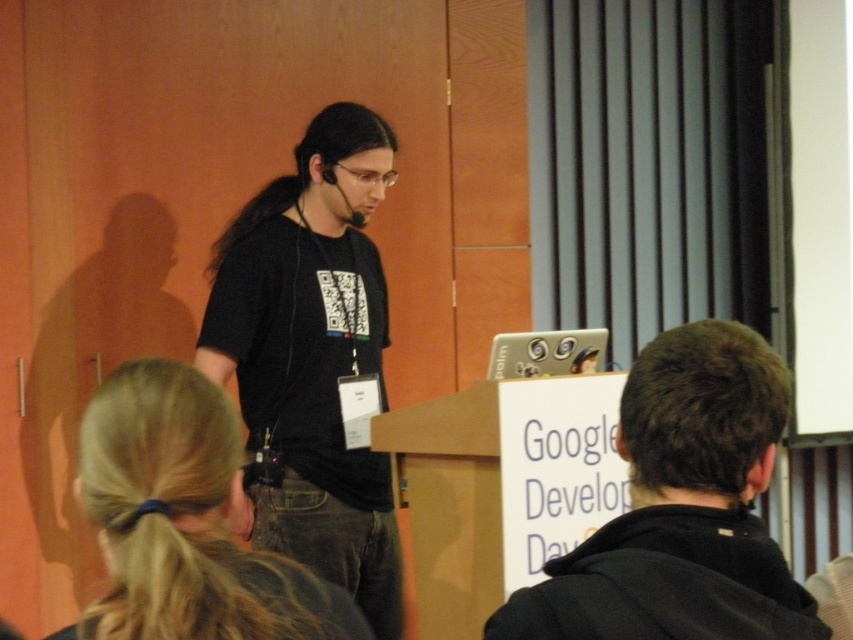
Question: Can you confirm if black matte jacket at center is wider than blonde hair at upper left?

Choices:
 (A) yes
 (B) no

Answer: (A)

Question: Which of the following is the farthest from the observer?

Choices:
 (A) (727, 388)
 (B) (335, 312)

Answer: (B)

Question: Which of the following is the closest to the observer?

Choices:
 (A) black matte t-shirt at center
 (B) black matte jacket at center
 (C) blonde hair at upper left

Answer: (C)

Question: Where is black matte jacket at center located in relation to blonde hair at upper left in the image?

Choices:
 (A) left
 (B) right

Answer: (B)

Question: Can you confirm if black matte jacket at center is positioned above blonde hair at upper left?

Choices:
 (A) no
 (B) yes

Answer: (B)

Question: Considering the real-world distances, which object is closest to the black matte t-shirt at center?

Choices:
 (A) blonde hair at upper left
 (B) black matte jacket at center

Answer: (A)